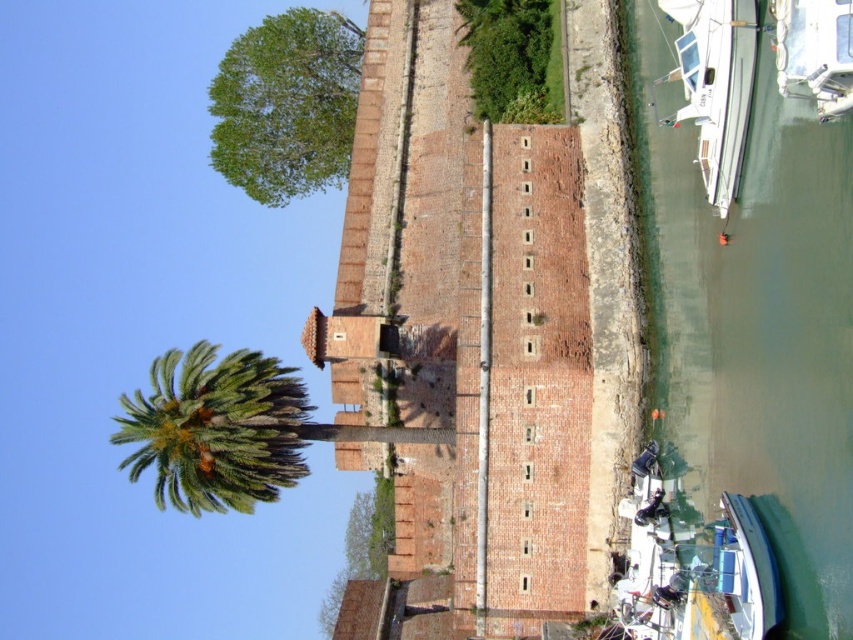
Question: Is brick tower at center closer to the viewer compared to white glossy boat at right?

Choices:
 (A) no
 (B) yes

Answer: (A)

Question: Is green leafy tree at upper center further to the viewer compared to white glossy boat at right?

Choices:
 (A) yes
 (B) no

Answer: (A)

Question: Does green water at right appear on the left side of white glossy boat at right?

Choices:
 (A) yes
 (B) no

Answer: (B)

Question: Based on their relative distances, which object is farther from the green leafy tree at center?

Choices:
 (A) brick tower at center
 (B) white glossy boat at right

Answer: (B)

Question: Based on their relative distances, which object is farther from the green leafy bush at upper center?

Choices:
 (A) green leafy tree at center
 (B) brick tower at center

Answer: (A)

Question: Which point is farther to the camera?

Choices:
 (A) (138, 467)
 (B) (543, 20)

Answer: (B)